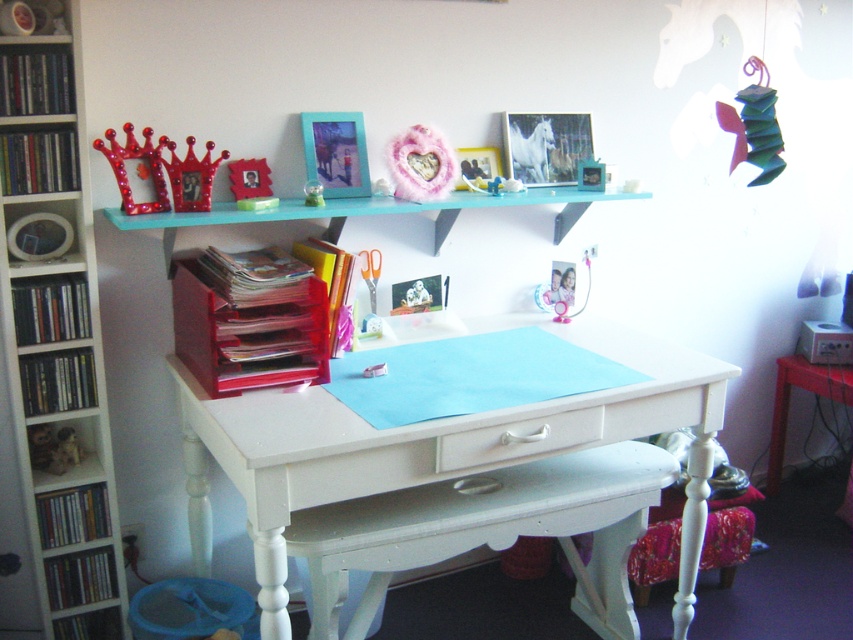
You are organizing a small pink gift box that is 10 cm in height. You want to place it on either the white wood bookcase at left or the fluffy pink heart at upper center. Which object can accommodate the gift box in terms of size?

The white wood bookcase at left has a larger size compared to the fluffy pink heart at upper center, so the gift box can be placed on the white wood bookcase at left.

You are standing in front of the workspace and want to reach the matte white horse at upper center. If your arm can extend 1.8 meters, can you reach it without moving your feet?

The matte white horse at upper center is 2.14 meters away from the camera, which is farther than your arm can reach. You cannot reach it without moving your feet.